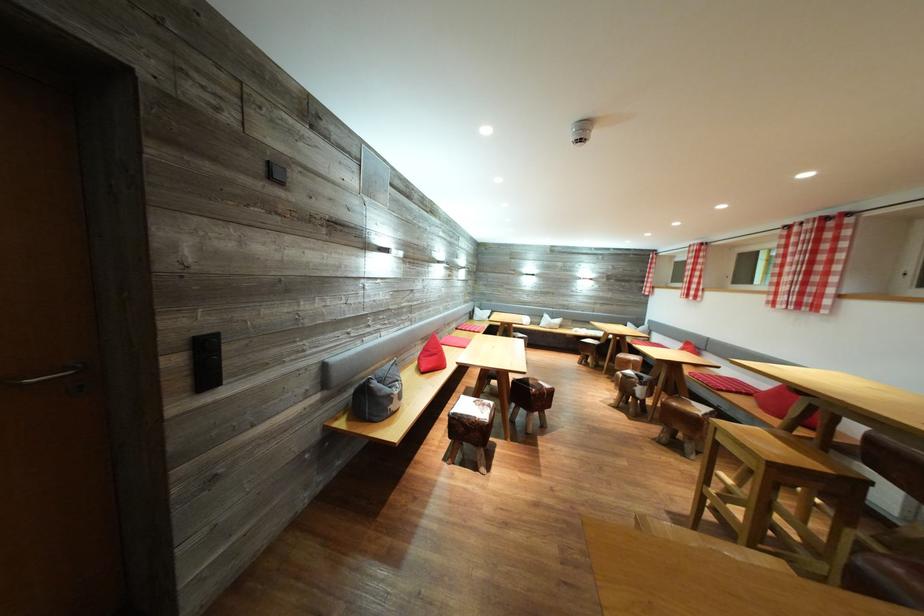
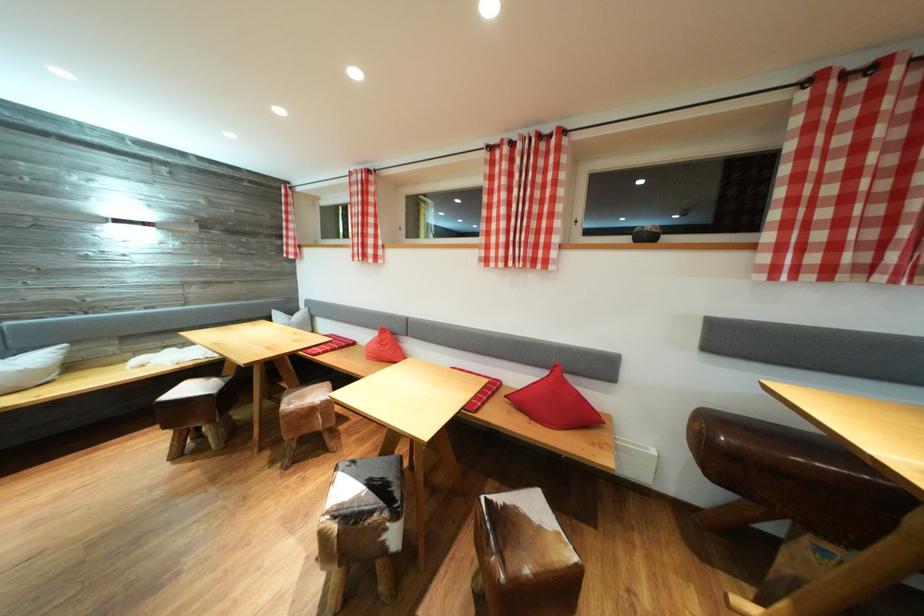
Find the pixel in the second image that matches point 560,323 in the first image.

(14, 358)